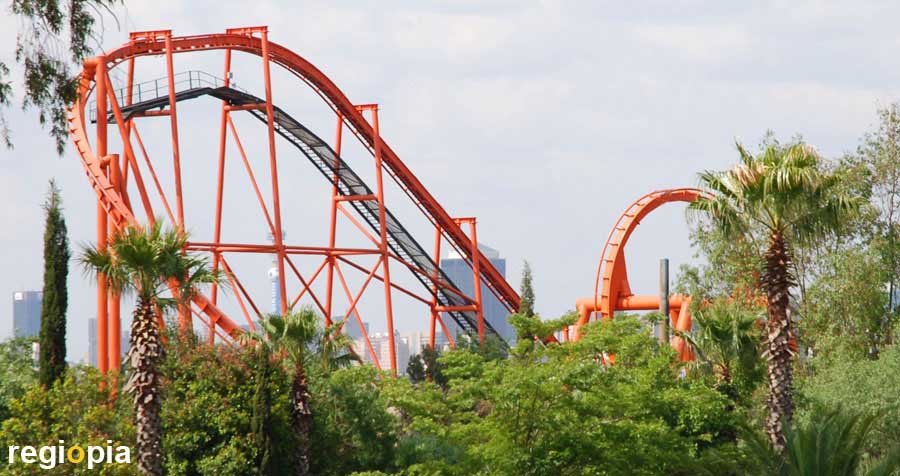
The height and width of the screenshot is (476, 900). What are the coordinates of `metal legs` in the screenshot? It's located at (216, 208), (276, 241), (333, 230), (382, 238), (434, 293), (475, 301), (177, 188), (130, 137), (101, 146).